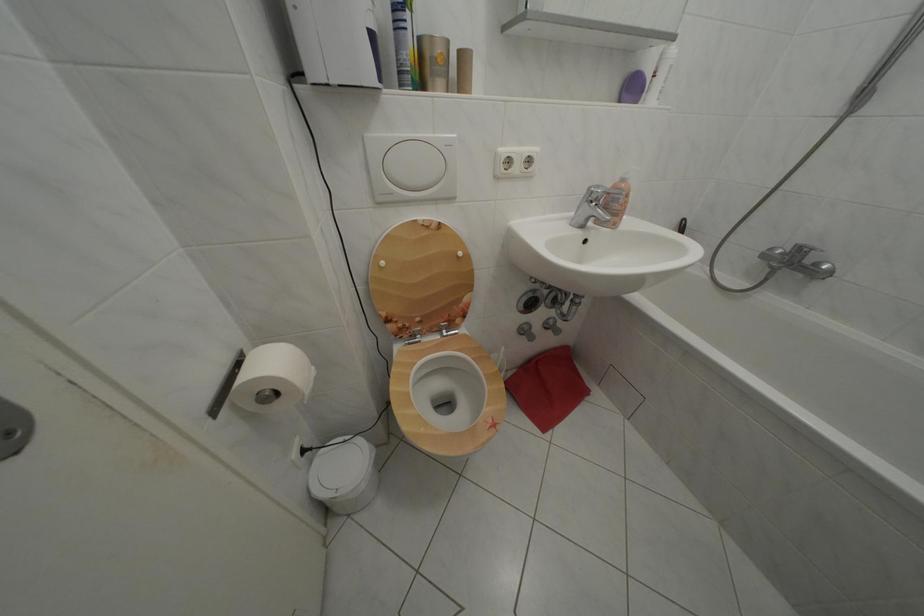
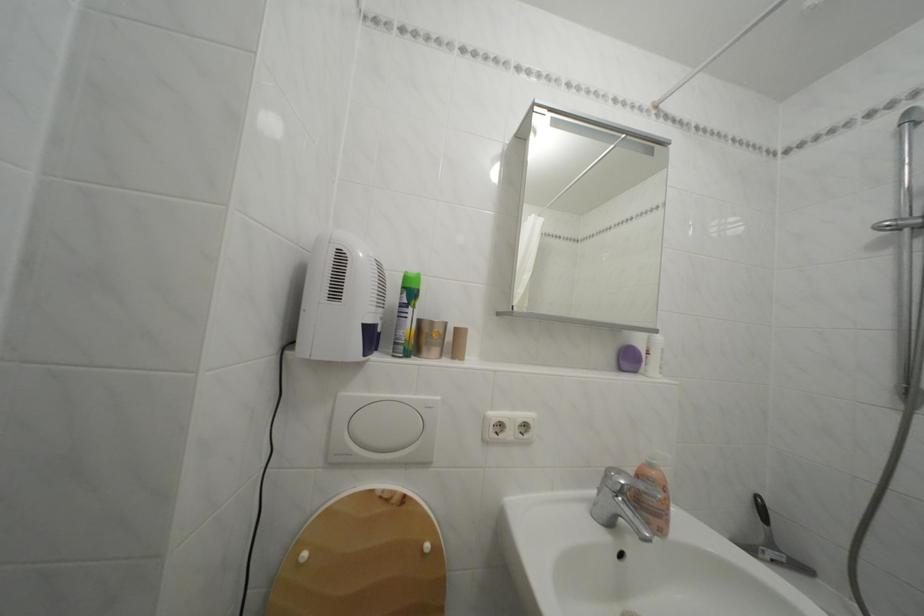
Question: Based on the continuous images, in which direction is the camera rotating? Reply with the corresponding letter.

Choices:
 (A) Left
 (B) Right
 (C) Up
 (D) Down

Answer: (C)